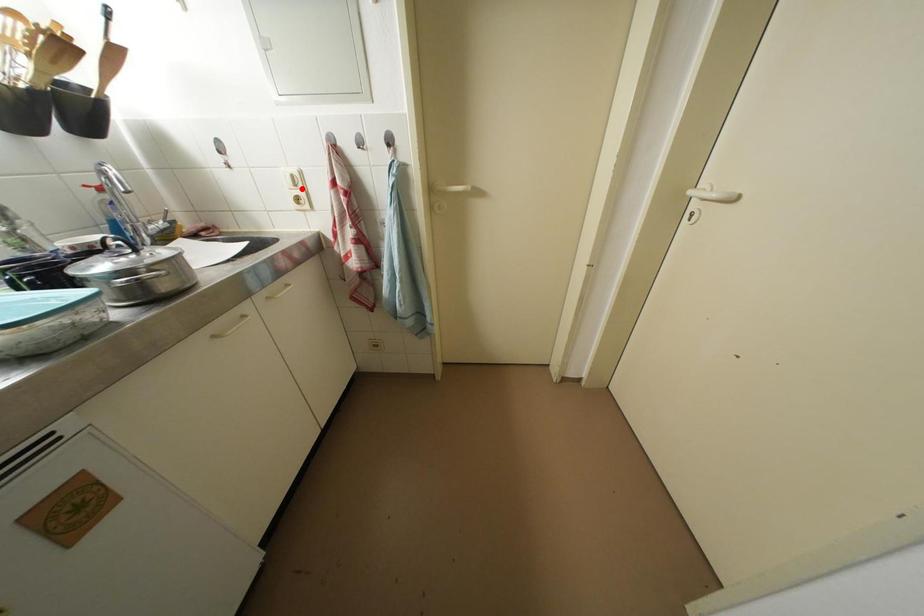
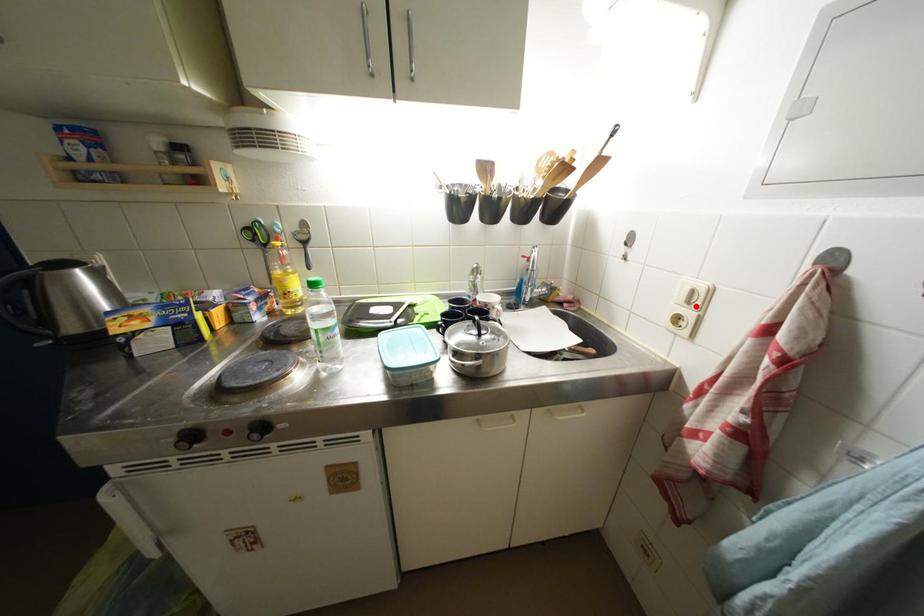
I am providing you with two images of the same scene from different viewpoints. A red point is marked on the first image and another point is marked on the second image. Is the red point in image1 aligned with the point shown in image2?

Yes